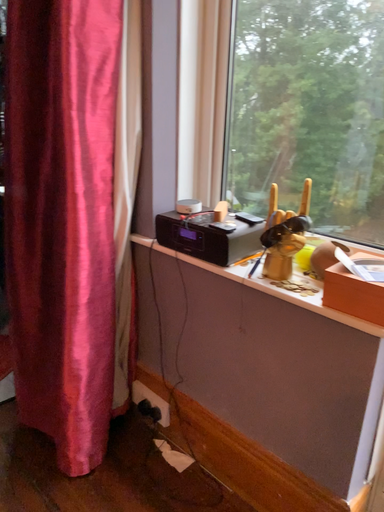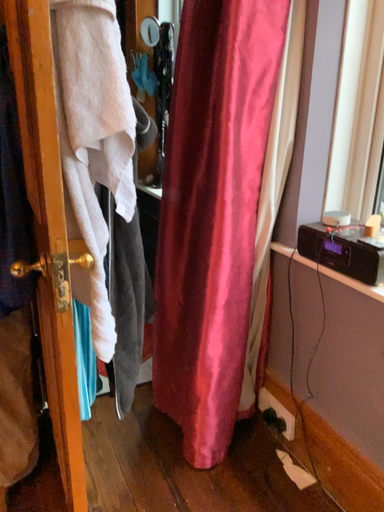
Question: Which way did the camera rotate in the video?

Choices:
 (A) rotated right
 (B) rotated left

Answer: (B)